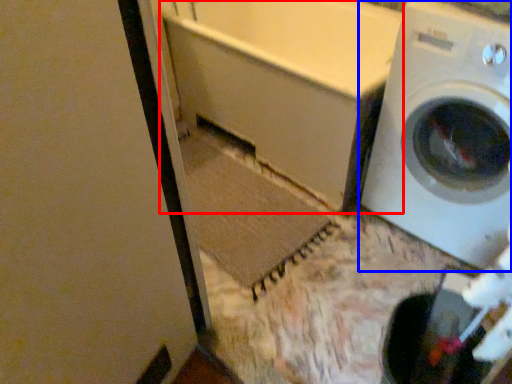
Question: Which object appears closest to the camera in this image, bath (highlighted by a red box) or washing machine (highlighted by a blue box)?

Choices:
 (A) bath
 (B) washing machine

Answer: (B)